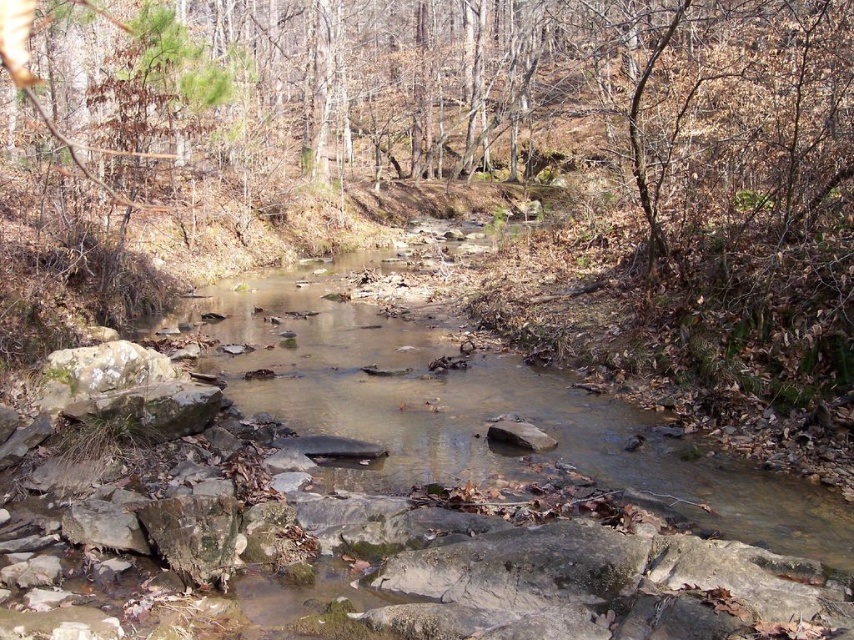
You are a hiker trying to cross the stream. You see the clear water stream at center and the smooth gray rock at center. Which object is higher in elevation?

The clear water stream at center is located above the smooth gray rock at center, so the clear water stream at center is higher in elevation.

You are standing at the origin point in the scene. Which direction should you move to reach the clear water stream at center?

The clear water stream at center is located at point [478,410], so you should move towards the coordinates [478,410] to reach it.